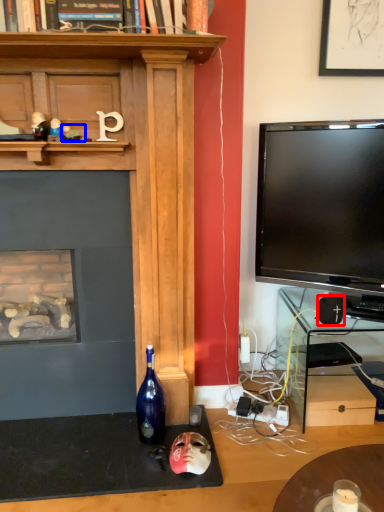
Question: Which object is further to the camera taking this photo, speaker (highlighted by a red box) or toy (highlighted by a blue box)?

Choices:
 (A) speaker
 (B) toy

Answer: (A)